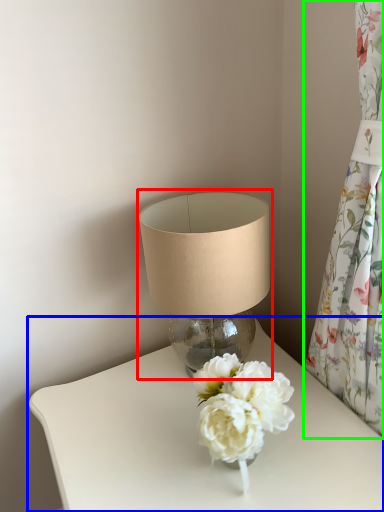
Question: Which object is positioned closest to lamp (highlighted by a red box)? Select from table (highlighted by a blue box) and curtain (highlighted by a green box).

Choices:
 (A) table
 (B) curtain

Answer: (A)